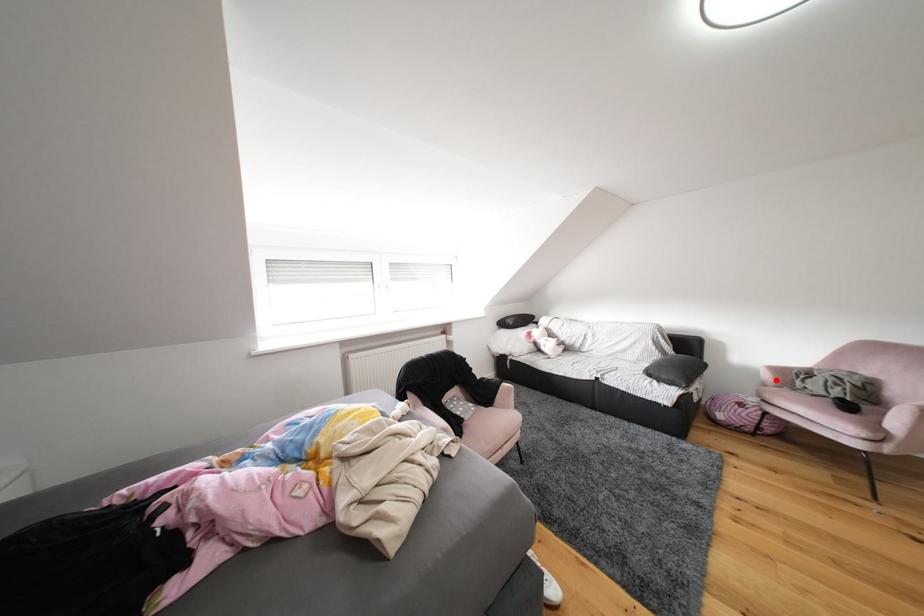
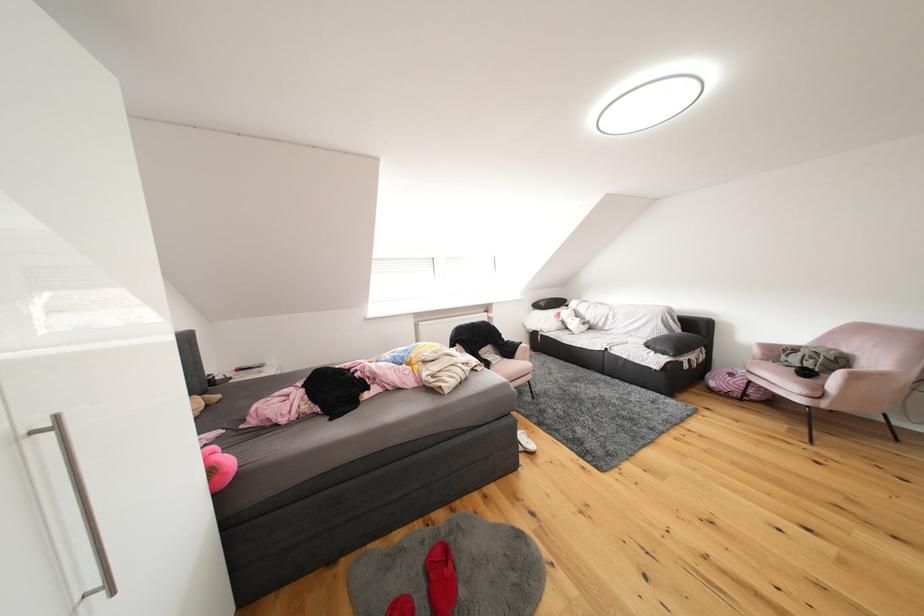
Locate, in the second image, the point that corresponds to the highlighted location in the first image.

(766, 355)